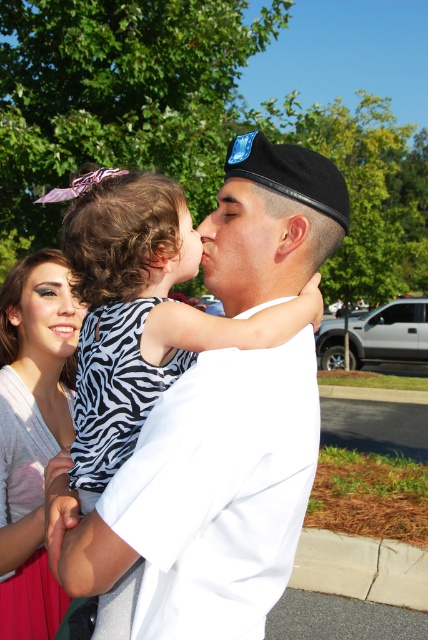
You are a photographer trying to capture the man in the white uniform at center and the matte black nose at center in your shot. Which object is nearer to your camera lens?

The white uniform at center is closer to the viewer than the matte black nose at center, so the white uniform at center would be nearer to the camera lens.

What are the coordinates of the white cotton shirt at center?

The white cotton shirt at center is located at coordinates point (214, 497).

Where is the white uniform at center positioned in the image?

The white uniform at center is positioned at coordinates point (x=113, y=392).